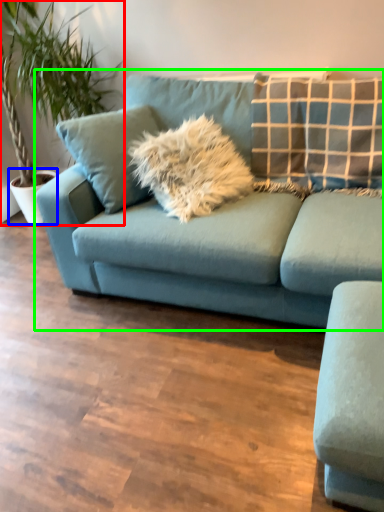
Question: Which object is positioned closest to houseplant (highlighted by a red box)? Select from flowerpot (highlighted by a blue box) and studio couch (highlighted by a green box).

Choices:
 (A) flowerpot
 (B) studio couch

Answer: (A)